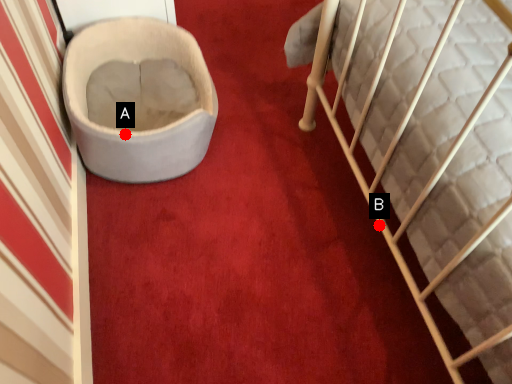
Question: Two points are circled on the image, labeled by A and B beside each circle. Which of the following is the closest to the observer?

Choices:
 (A) A is closer
 (B) B is closer

Answer: (A)